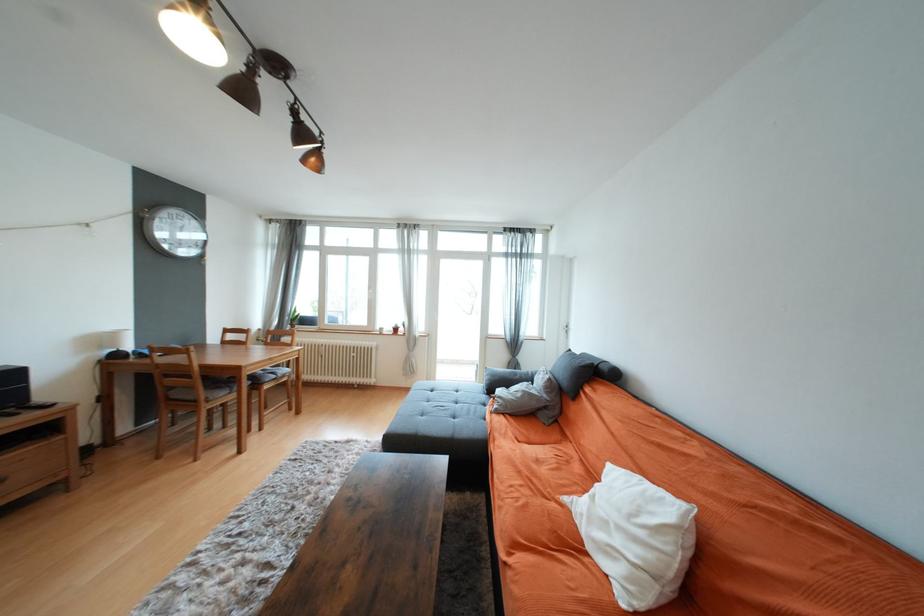
The height and width of the screenshot is (616, 924). Identify the location of gray sofa sitting surface. (451, 400).